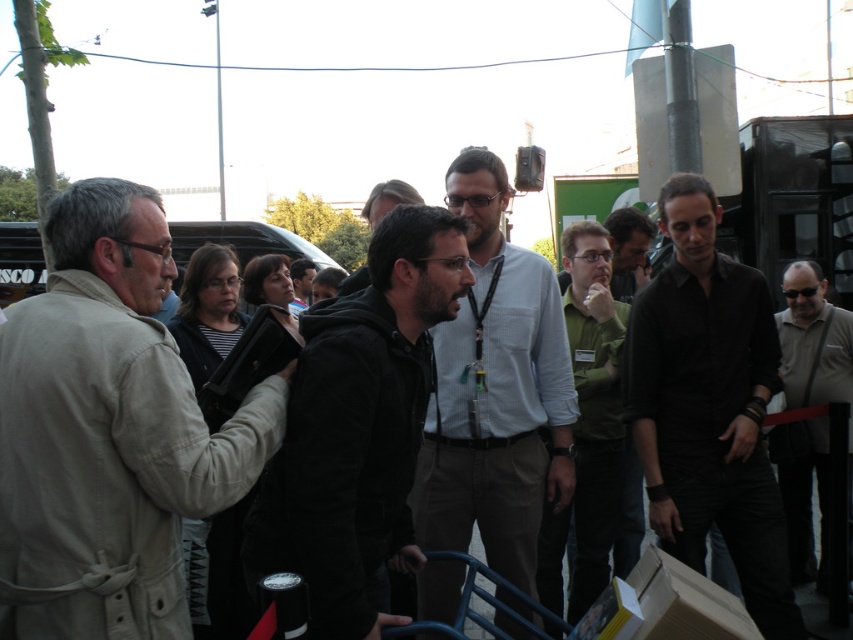
Based on the scene description, which object has a greater width between the beige fabric trench coat at left and the light blue shirt at center?

The beige fabric trench coat at left has a greater width than the light blue shirt at center according to the description.

You are organizing a photo shoot and need to ensure that all participants are visible in the frame. Given that the light blue shirt at center and the matte black shirt at center are both in the center area, which one should you focus on to ensure both are visible?

The light blue shirt at center is larger in size than the matte black shirt at center, so focusing on the light blue shirt at center would ensure both are visible as it takes up more space in the frame.

You are standing in the crowd and want to approach the person wearing the green matte shirt at center. Which direction should you move to reach them from the beige fabric trench coat at left?

The beige fabric trench coat at left is to the left of the green matte shirt at center, so to reach the green matte shirt at center, move to the right from the beige fabric trench coat at left.